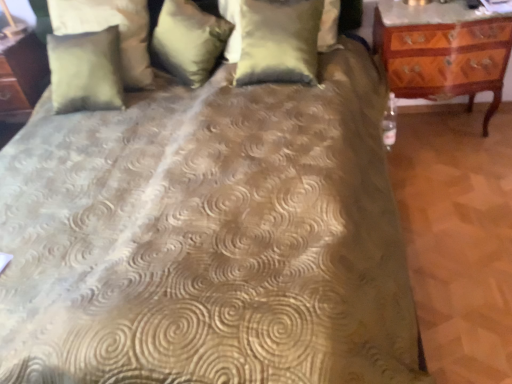
Question: From a real-world perspective, is suede-like beige pillow at upper left, arranged as the first pillow when viewed from the left, below satin gold pillow at upper center, which is counted as the 2th pillow, starting from the right?

Choices:
 (A) yes
 (B) no

Answer: (B)

Question: Is satin gold pillow at upper center, the second pillow positioned from the left, at the back of suede-like beige pillow at upper left, arranged as the first pillow when viewed from the left?

Choices:
 (A) yes
 (B) no

Answer: (B)

Question: Considering the relative sizes of suede-like beige pillow at upper left, arranged as the first pillow when viewed from the left, and satin gold pillow at upper center, which is counted as the 2th pillow, starting from the right, in the image provided, is suede-like beige pillow at upper left, arranged as the first pillow when viewed from the left, taller than satin gold pillow at upper center, which is counted as the 2th pillow, starting from the right,?

Choices:
 (A) yes
 (B) no

Answer: (A)

Question: Is the surface of suede-like beige pillow at upper left, arranged as the first pillow when viewed from the left, in direct contact with satin gold pillow at upper center, the second pillow positioned from the left?

Choices:
 (A) yes
 (B) no

Answer: (B)

Question: From a real-world perspective, is suede-like beige pillow at upper left, the third pillow when ordered from right to left, positioned over satin gold pillow at upper center, the second pillow positioned from the left, based on gravity?

Choices:
 (A) no
 (B) yes

Answer: (B)

Question: Does suede-like beige pillow at upper left, the third pillow when ordered from right to left, appear on the left side of satin gold pillow at upper center, the second pillow positioned from the left?

Choices:
 (A) no
 (B) yes

Answer: (B)

Question: Is satin gold pillow at center, placed as the first pillow when sorted from right to left, facing away from satin gold pillow at upper center, which is counted as the 2th pillow, starting from the right?

Choices:
 (A) no
 (B) yes

Answer: (A)

Question: From the image's perspective, is satin gold pillow at center, placed as the first pillow when sorted from right to left, on satin gold pillow at upper center, the second pillow positioned from the left?

Choices:
 (A) yes
 (B) no

Answer: (B)

Question: Could you tell me if satin gold pillow at center, the third pillow from the left, is turned towards satin gold pillow at upper center, which is counted as the 2th pillow, starting from the right?

Choices:
 (A) no
 (B) yes

Answer: (A)

Question: Does satin gold pillow at center, placed as the first pillow when sorted from right to left, have a lesser height compared to satin gold pillow at upper center, which is counted as the 2th pillow, starting from the right?

Choices:
 (A) yes
 (B) no

Answer: (B)

Question: From the image's perspective, does satin gold pillow at center, placed as the first pillow when sorted from right to left, appear lower than satin gold pillow at upper center, the second pillow positioned from the left?

Choices:
 (A) no
 (B) yes

Answer: (B)

Question: From a real-world perspective, is satin gold pillow at center, the third pillow from the left, on top of satin gold pillow at upper center, which is counted as the 2th pillow, starting from the right?

Choices:
 (A) yes
 (B) no

Answer: (A)

Question: Could you tell me if satin gold pillow at upper center, which is counted as the 2th pillow, starting from the right, is facing suede-like beige pillow at upper left, arranged as the first pillow when viewed from the left?

Choices:
 (A) yes
 (B) no

Answer: (A)